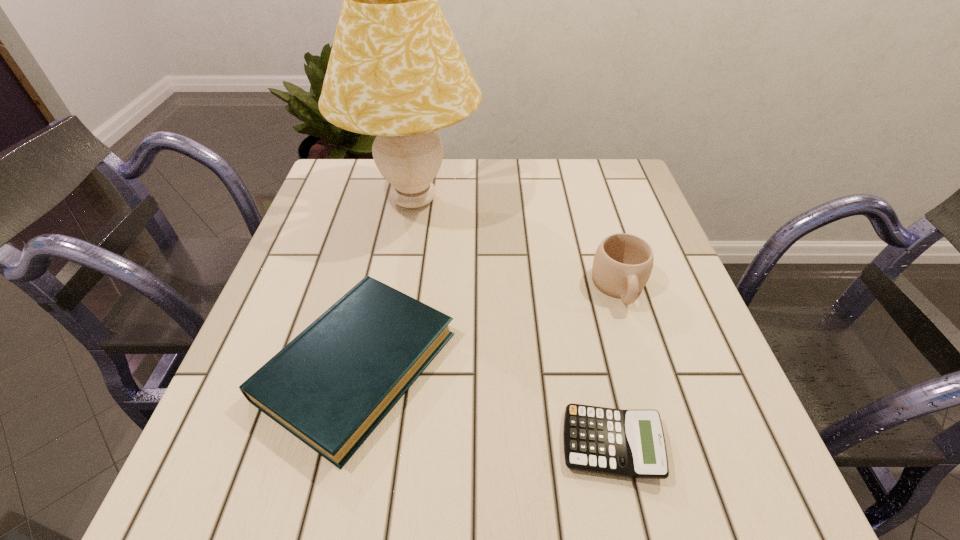
In the image, there is a desktop. Identify the location of vacant region at the near edge. This screenshot has width=960, height=540. (446, 463).

The width and height of the screenshot is (960, 540). In order to click on free space at the left edge of the desktop in this screenshot , I will do `click(332, 216)`.

Find the location of a particular element. The image size is (960, 540). vacant space at the right edge of the desktop is located at coordinates (655, 400).

Where is `vacant area at the far left corner`? The width and height of the screenshot is (960, 540). vacant area at the far left corner is located at coordinates (363, 188).

In the image, there is a desktop. Identify the location of free space at the far right corner. This screenshot has width=960, height=540. (590, 179).

Locate an element on the screen. The width and height of the screenshot is (960, 540). free space at the near right corner is located at coordinates (766, 485).

Image resolution: width=960 pixels, height=540 pixels. I want to click on free space between the second shortest object and the farthest object, so click(x=386, y=283).

Image resolution: width=960 pixels, height=540 pixels. In order to click on free space between the farthest object and the calculator in this screenshot , I will do `click(513, 322)`.

Find the location of `free space that is in between the book and the second tallest object`. free space that is in between the book and the second tallest object is located at coordinates (489, 326).

This screenshot has width=960, height=540. Identify the location of free space between the mug and the book. (489, 326).